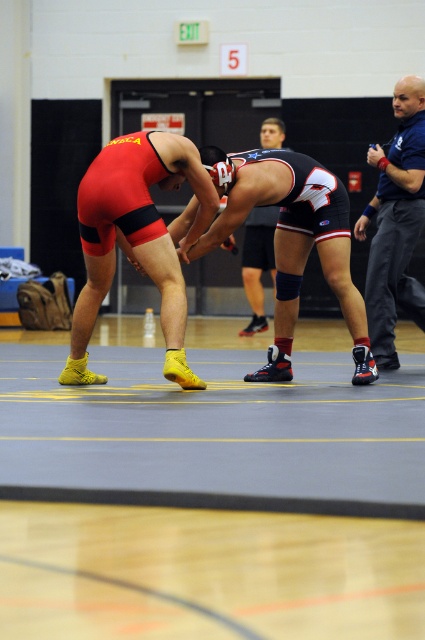
Question: Which point is closer to the camera taking this photo?

Choices:
 (A) (373, 204)
 (B) (265, 228)
 (C) (255, 204)
 (D) (144, 228)

Answer: (D)

Question: Does matte red wrestling singlet at center have a lesser width compared to blue uniform at right?

Choices:
 (A) yes
 (B) no

Answer: (B)

Question: Does matte red wrestling singlet at center have a smaller size compared to blue uniform at right?

Choices:
 (A) no
 (B) yes

Answer: (A)

Question: Considering the real-world distances, which object is farthest from the shiny black shorts at center?

Choices:
 (A) blue uniform at right
 (B) shiny black wrestling singlet at center

Answer: (B)

Question: Based on their relative distances, which object is nearer to the blue uniform at right?

Choices:
 (A) shiny black wrestling singlet at center
 (B) matte red wrestling singlet at center
 (C) shiny black shorts at center

Answer: (A)

Question: Is blue uniform at right thinner than shiny black shorts at center?

Choices:
 (A) yes
 (B) no

Answer: (B)